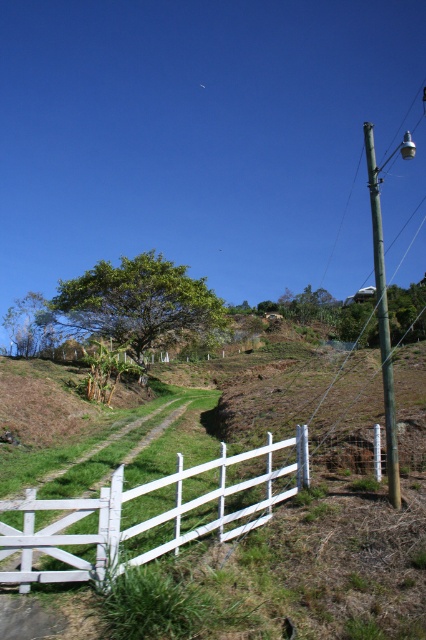
Describe the element at coordinates (382, 321) in the screenshot. I see `green painted wood pole at right` at that location.

This screenshot has width=426, height=640. In order to click on green painted wood pole at right in this screenshot , I will do `click(382, 321)`.

Does white wooden fence at lower center have a greater width compared to green painted wood pole at right?

No.

Which is below, white wooden fence at lower center or green painted wood pole at right?

white wooden fence at lower center

What do you see at coordinates (144, 518) in the screenshot? Image resolution: width=426 pixels, height=640 pixels. I see `white wooden fence at lower center` at bounding box center [144, 518].

Locate an element on the screen. The image size is (426, 640). white wooden fence at lower center is located at coordinates (144, 518).

Is white wooden fence at lower center below green leafy tree at center?

Correct, white wooden fence at lower center is located below green leafy tree at center.

Can you confirm if white wooden fence at lower center is smaller than green leafy tree at center?

Yes.

Which is behind, point (80, 500) or point (154, 276)?

Point (154, 276)

At what (x,y) coordinates should I click in order to perform the action: click on white wooden fence at lower center. Please return your answer as a coordinate pair (x, y). Image resolution: width=426 pixels, height=640 pixels. Looking at the image, I should click on 144,518.